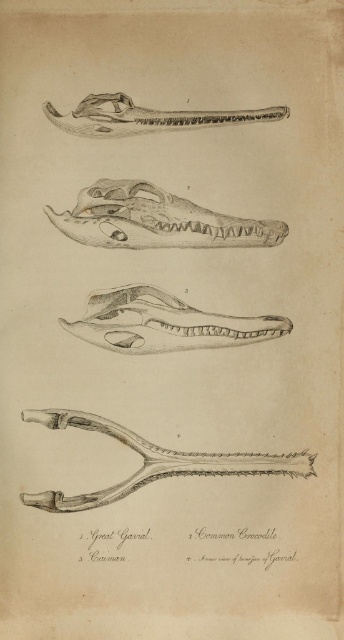
Question: Can you confirm if matte black skull at center is wider than matte gray skull at center?

Choices:
 (A) no
 (B) yes

Answer: (B)

Question: Does matte black skull at center lie in front of matte gray skull at center?

Choices:
 (A) no
 (B) yes

Answer: (B)

Question: Among these objects, which one is farthest from the camera?

Choices:
 (A) matte black skull at center
 (B) matte gray skull at center

Answer: (B)

Question: Can you confirm if matte black skull at center is thinner than matte gray skull at center?

Choices:
 (A) yes
 (B) no

Answer: (B)

Question: Which object appears closest to the camera in this image?

Choices:
 (A) matte black skull at center
 (B) matte gray skull at center

Answer: (A)